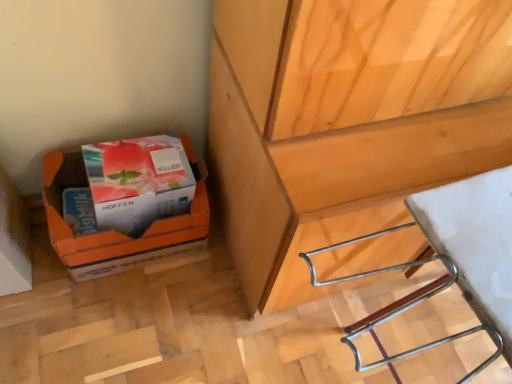
Question: From a real-world perspective, is white plastic stool at lower right physically above orange cardboard box at lower left?

Choices:
 (A) yes
 (B) no

Answer: (A)

Question: Does white plastic stool at lower right have a larger size compared to orange cardboard box at lower left?

Choices:
 (A) no
 (B) yes

Answer: (B)

Question: Is white plastic stool at lower right closer to the viewer compared to orange cardboard box at lower left?

Choices:
 (A) yes
 (B) no

Answer: (A)

Question: Is white plastic stool at lower right next to orange cardboard box at lower left?

Choices:
 (A) no
 (B) yes

Answer: (A)

Question: Would you say white plastic stool at lower right is outside orange cardboard box at lower left?

Choices:
 (A) no
 (B) yes

Answer: (B)

Question: Considering the positions of point [x=461, y=226] and point [x=53, y=208], is point [x=461, y=226] closer or farther from the camera than point [x=53, y=208]?

Choices:
 (A) farther
 (B) closer

Answer: (B)

Question: Considering the relative positions of white plastic stool at lower right and orange cardboard box at lower left in the image provided, is white plastic stool at lower right to the left or to the right of orange cardboard box at lower left?

Choices:
 (A) right
 (B) left

Answer: (A)

Question: Considering the positions of white plastic stool at lower right and orange cardboard box at lower left in the image, is white plastic stool at lower right taller or shorter than orange cardboard box at lower left?

Choices:
 (A) short
 (B) tall

Answer: (B)

Question: From a real-world perspective, relative to orange cardboard box at lower left, is white plastic stool at lower right vertically above or below?

Choices:
 (A) above
 (B) below

Answer: (A)

Question: In the image, is matte white box at lower left positioned in front of or behind white plastic stool at lower right?

Choices:
 (A) behind
 (B) front

Answer: (A)

Question: Do you think matte white box at lower left is within white plastic stool at lower right, or outside of it?

Choices:
 (A) inside
 (B) outside

Answer: (B)

Question: From a real-world perspective, is matte white box at lower left physically located above or below white plastic stool at lower right?

Choices:
 (A) above
 (B) below

Answer: (B)

Question: Considering the positions of matte white box at lower left and white plastic stool at lower right in the image, is matte white box at lower left wider or thinner than white plastic stool at lower right?

Choices:
 (A) wide
 (B) thin

Answer: (B)

Question: Considering the positions of white plastic stool at lower right and matte white box at lower left in the image, is white plastic stool at lower right bigger or smaller than matte white box at lower left?

Choices:
 (A) big
 (B) small

Answer: (A)

Question: From the image's perspective, is white plastic stool at lower right located above or below matte white box at lower left?

Choices:
 (A) below
 (B) above

Answer: (A)